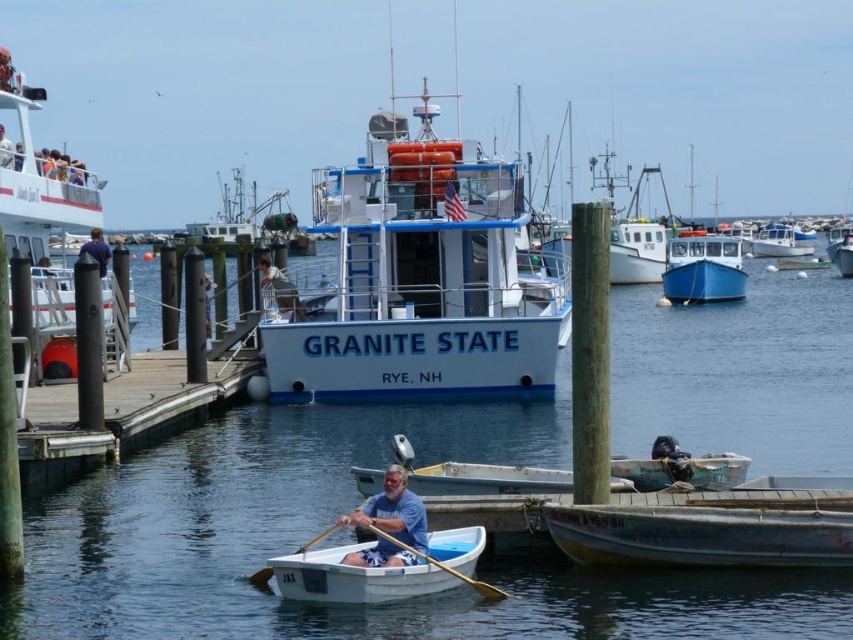
Question: Does clear blue water at center appear over white plastic boat at left?

Choices:
 (A) no
 (B) yes

Answer: (A)

Question: Is metallic gray canoe at lower right smaller than wooden at lower center?

Choices:
 (A) no
 (B) yes

Answer: (B)

Question: Among these points, which one is nearest to the camera?

Choices:
 (A) (469, 580)
 (B) (207, 317)
 (C) (251, 580)

Answer: (A)

Question: Which point is closer to the camera taking this photo?

Choices:
 (A) click(695, 273)
 (B) click(83, 252)
 (C) click(695, 284)
 (D) click(469, 554)

Answer: (D)

Question: Which of the following is the farthest from the observer?

Choices:
 (A) (204, 300)
 (B) (433, 545)
 (C) (393, 504)

Answer: (A)

Question: Where is white wooden canoe at lower right located in relation to wooden at left in the image?

Choices:
 (A) above
 (B) below

Answer: (A)